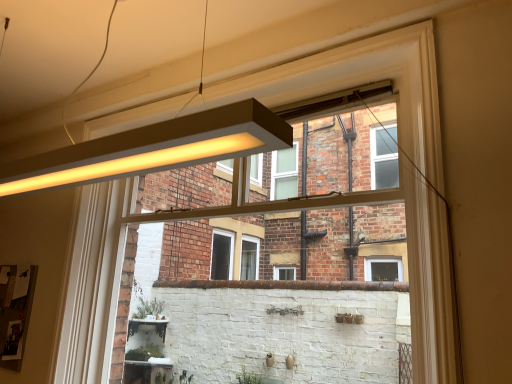
The height and width of the screenshot is (384, 512). In order to click on matte white frame at upper center in this screenshot , I will do `click(266, 297)`.

What is the approximate height of matte white frame at upper center?

1.40 meters.

Describe the element at coordinates (266, 297) in the screenshot. I see `matte white frame at upper center` at that location.

You are a GUI agent. You are given a task and a screenshot of the screen. Output one action in this format:
    pyautogui.click(x=<x>, y=<y>)
    Task: Click on the matte white frame at upper center
    
    Given the screenshot: What is the action you would take?
    [266, 297]